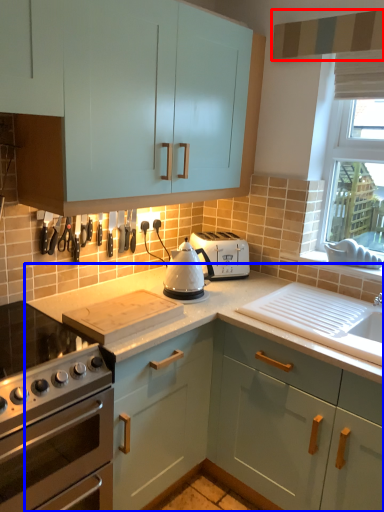
Question: Which object is closer to the camera taking this photo, exhaust hood (highlighted by a red box) or countertop (highlighted by a blue box)?

Choices:
 (A) exhaust hood
 (B) countertop

Answer: (B)